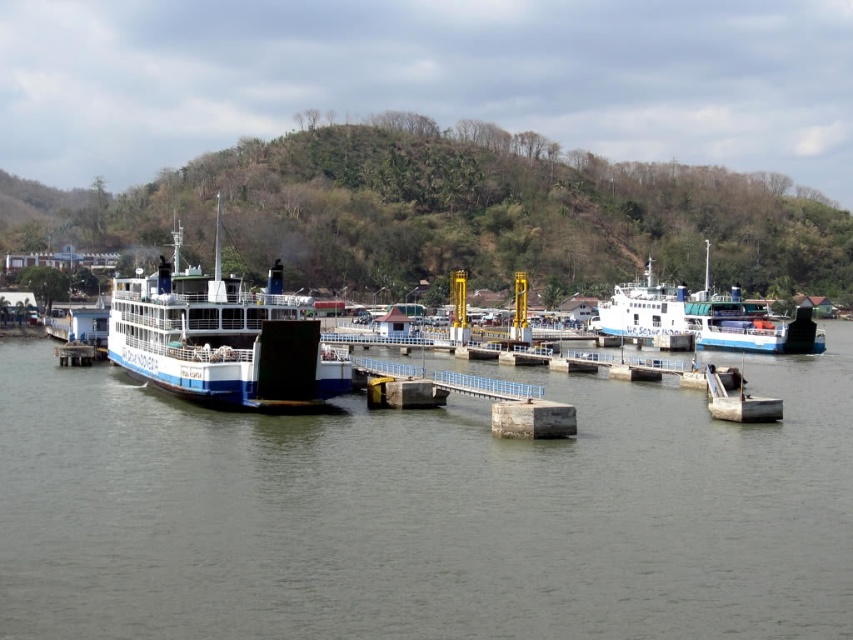
Can you confirm if clear water at center is thinner than white glossy ferry at center?

Incorrect, clear water at center's width is not less than white glossy ferry at center's.

Does clear water at center have a greater height compared to white glossy ferry at center?

In fact, clear water at center may be shorter than white glossy ferry at center.

Does point (251, 486) come behind point (759, 308)?

No, (251, 486) is in front of (759, 308).

Locate an element on the screen. The height and width of the screenshot is (640, 853). clear water at center is located at coordinates (425, 513).

Can you confirm if blue matte ferry at center is shorter than white glossy ferry at center?

No, blue matte ferry at center is not shorter than white glossy ferry at center.

Measure the distance between point (271, 304) and camera.

The distance of point (271, 304) from camera is 203.42 feet.

Identify the location of blue matte ferry at center. This screenshot has width=853, height=640. (221, 337).

Consider the image. Is clear water at center bigger than blue matte ferry at center?

Actually, clear water at center might be smaller than blue matte ferry at center.

Does clear water at center have a lesser width compared to blue matte ferry at center?

Incorrect, clear water at center's width is not less than blue matte ferry at center's.

This screenshot has width=853, height=640. What do you see at coordinates (425, 513) in the screenshot?
I see `clear water at center` at bounding box center [425, 513].

Locate an element on the screen. The image size is (853, 640). clear water at center is located at coordinates (425, 513).